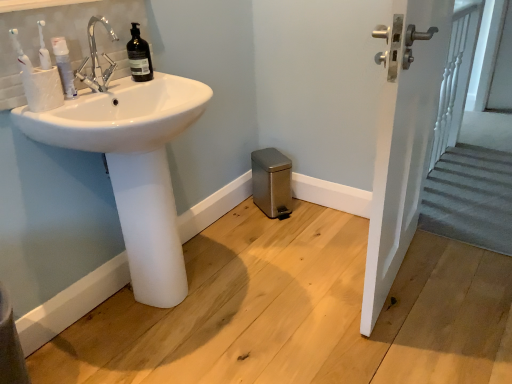
This screenshot has height=384, width=512. In order to click on vacant space behind white glossy sink at left in this screenshot , I will do `click(229, 233)`.